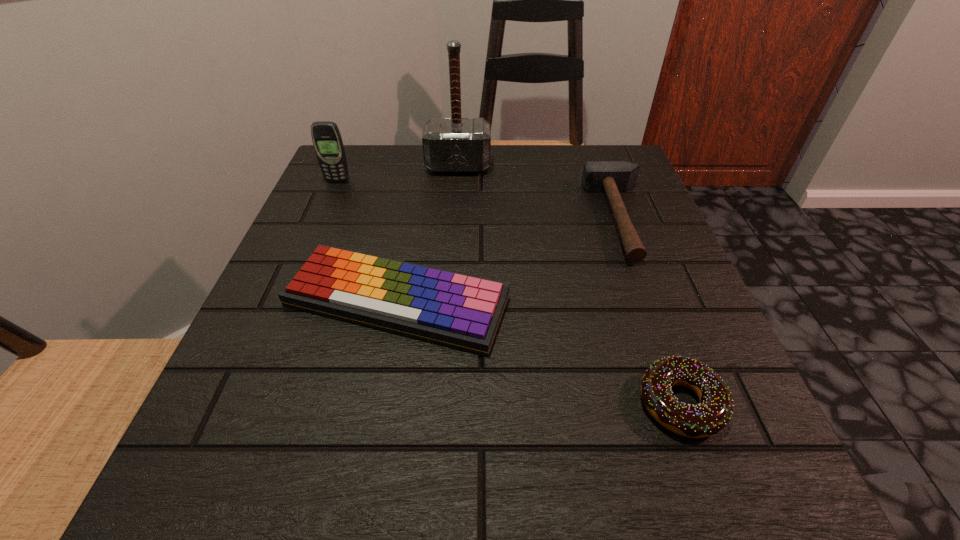
Identify the location of the tallest object. (452, 145).

Identify the location of the farther hammer. This screenshot has width=960, height=540. (452, 145).

Find the location of a particular element. The height and width of the screenshot is (540, 960). cellular telephone is located at coordinates (326, 137).

Locate an element on the screen. The width and height of the screenshot is (960, 540). the third tallest object is located at coordinates (612, 177).

At what (x,y) coordinates should I click in order to perform the action: click on the nearer hammer. Please return your answer as a coordinate pair (x, y). The image size is (960, 540). Looking at the image, I should click on (612, 177).

The width and height of the screenshot is (960, 540). I want to click on computer keyboard, so click(461, 311).

Identify the location of the nearest object. (713, 413).

Find the location of a particular element. The image size is (960, 540). free location located on the right of the left hammer is located at coordinates (614, 166).

The width and height of the screenshot is (960, 540). Find the location of `blank space located on the screen of the fourth shortest object`. blank space located on the screen of the fourth shortest object is located at coordinates (331, 196).

Find the location of `vacant position located on the striking surface of the right hammer`. vacant position located on the striking surface of the right hammer is located at coordinates (396, 218).